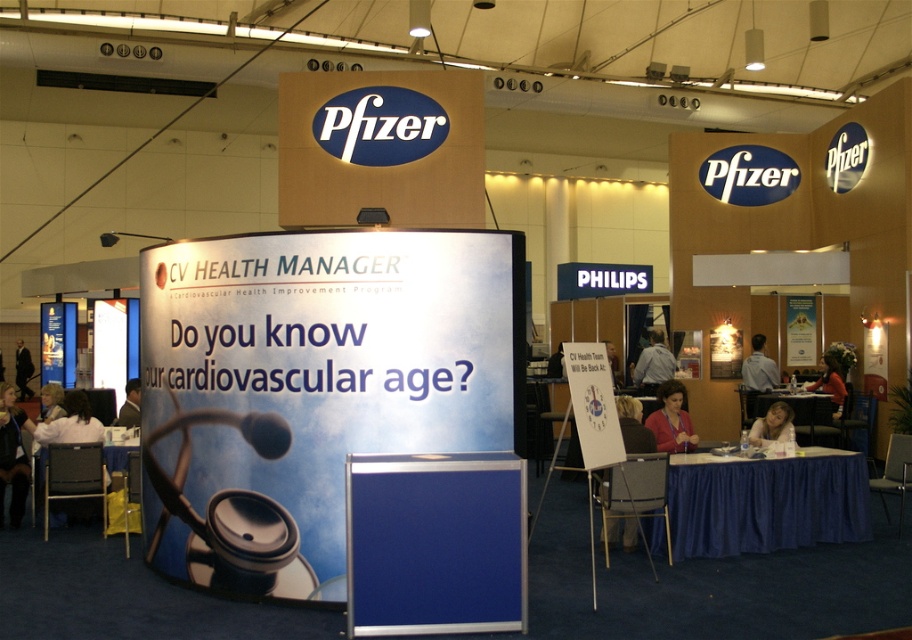
Question: From the image, what is the correct spatial relationship of blonde hair at lower right in relation to blonde hair at center?

Choices:
 (A) below
 (B) above

Answer: (B)

Question: Which point is farther to the camera?

Choices:
 (A) blonde hair at lower right
 (B) matte pink blouse at center
 (C) dark suit jacket at center

Answer: (C)

Question: Can you confirm if matte pink blouse at center is positioned to the left of gray fabric shirt at center?

Choices:
 (A) no
 (B) yes

Answer: (B)

Question: Can you confirm if dark blue shirt at lower left is positioned to the right of dark brown hair at center?

Choices:
 (A) yes
 (B) no

Answer: (B)

Question: Among these points, which one is nearest to the camera?

Choices:
 (A) (2, 432)
 (B) (138, 381)

Answer: (A)

Question: Considering the real-world distances, which object is closest to the dark blue suit at left?

Choices:
 (A) dark brown hair at center
 (B) dark suit jacket at center
 (C) matte pink blouse at center
 (D) gray fabric shirt at center

Answer: (B)